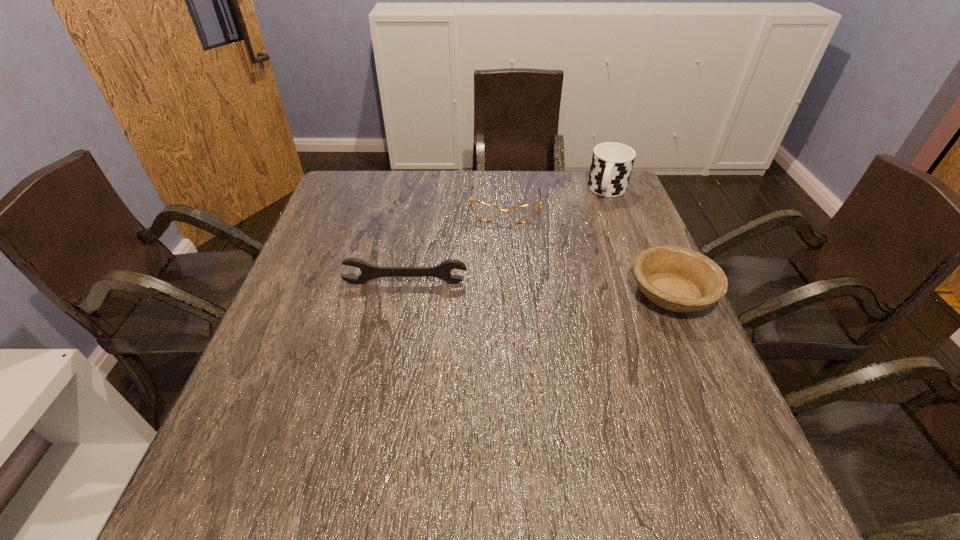
Where is `free spot that satisfies the following two spatial constraints: 1. on the open ends of the wrench; 2. on the right side of the bowl`? Image resolution: width=960 pixels, height=540 pixels. free spot that satisfies the following two spatial constraints: 1. on the open ends of the wrench; 2. on the right side of the bowl is located at coordinates (403, 293).

The width and height of the screenshot is (960, 540). I want to click on free space that satisfies the following two spatial constraints: 1. on the front side of the bowl; 2. on the left side of the spectacles, so click(x=512, y=293).